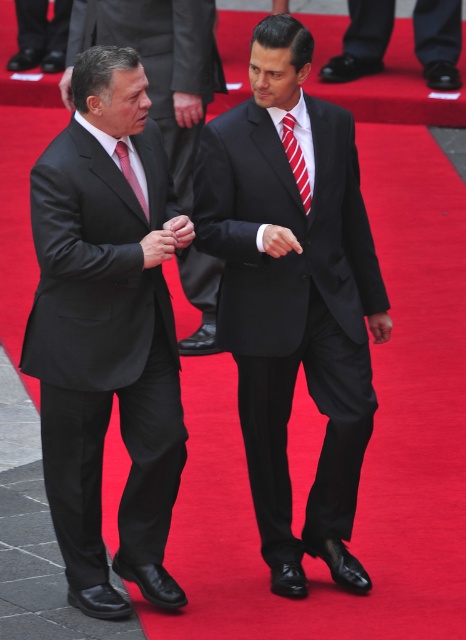
Between matte black suit at left and matte pink tie at left, which one appears on the left side from the viewer's perspective?

matte black suit at left

Is matte black suit at left above matte pink tie at left?

Indeed, matte black suit at left is positioned over matte pink tie at left.

Identify the location of matte black suit at left. The width and height of the screenshot is (466, 640). (159, 67).

Can you confirm if black leather shoes at lower center is positioned to the right of matte black suit at center?

Correct, you'll find black leather shoes at lower center to the right of matte black suit at center.

Who is more forward, (371, 29) or (177, 232)?

Positioned in front is point (177, 232).

Find the location of `black leather shoes at lower center`. black leather shoes at lower center is located at coordinates (362, 42).

Does black matte suit at center have a larger size compared to red striped tie at center?

Indeed, black matte suit at center has a larger size compared to red striped tie at center.

Who is more distant from viewer, (x=89, y=388) or (x=292, y=170)?

The point (x=292, y=170) is more distant.

Who is more distant from viewer, (153, 531) or (295, 161)?

The point (153, 531) is behind.

Where is `black matte suit at center`? Image resolution: width=466 pixels, height=640 pixels. black matte suit at center is located at coordinates [x=102, y=348].